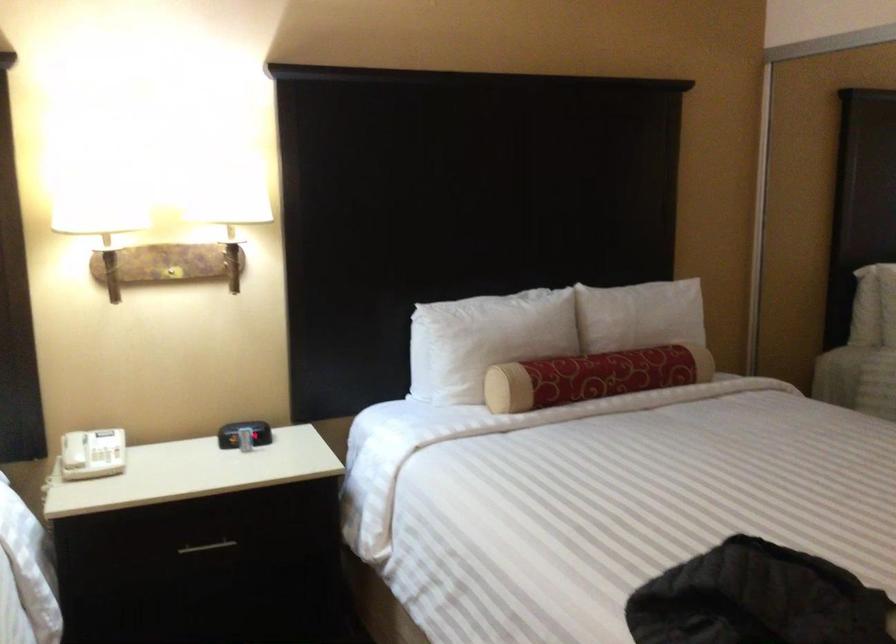
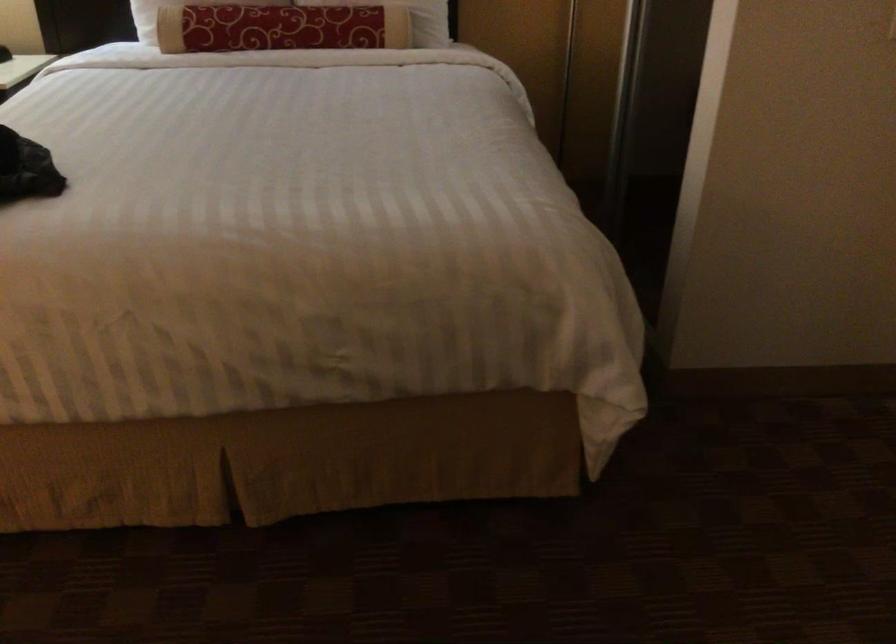
Where in the second image is the point corresponding to the point at 638,355 from the first image?

(311, 15)